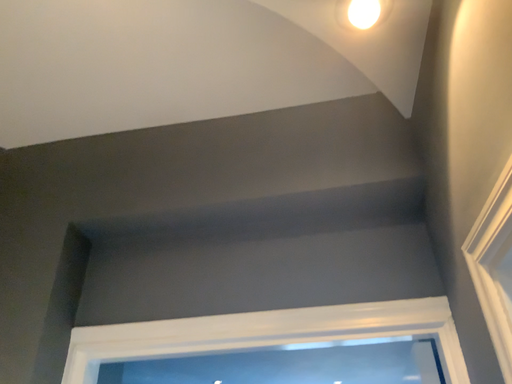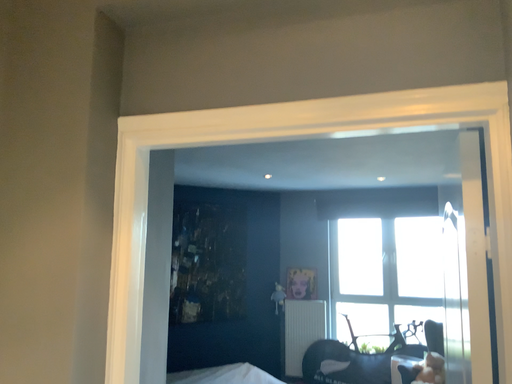
Question: Which way did the camera rotate in the video?

Choices:
 (A) rotated left
 (B) rotated right

Answer: (A)